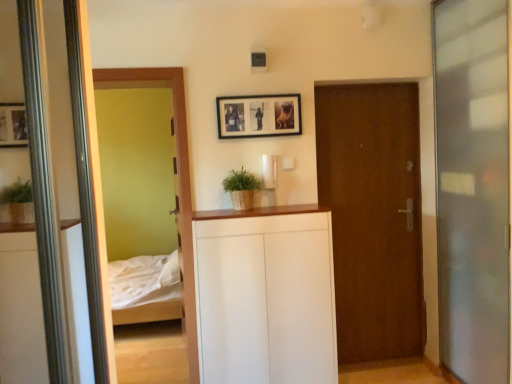
Where is `vacant location below brown wooden door at center (from a real-world perspective)`? The width and height of the screenshot is (512, 384). vacant location below brown wooden door at center (from a real-world perspective) is located at coordinates (365, 362).